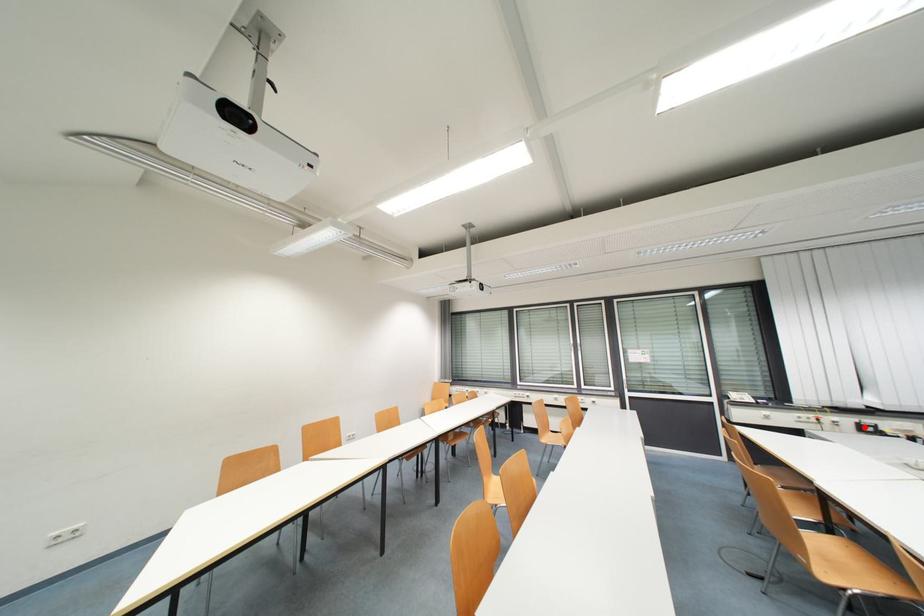
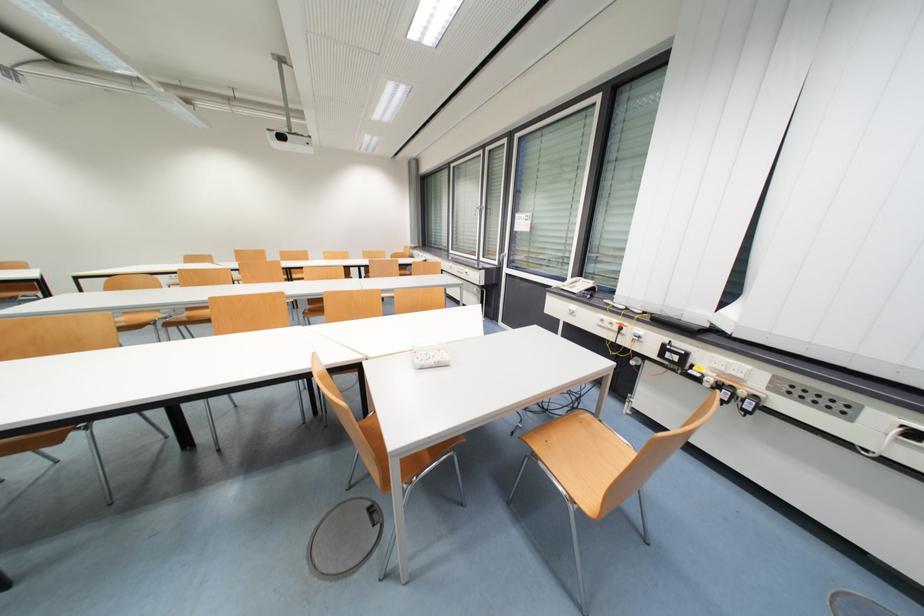
The point at the highlighted location is marked in the first image. Where is the corresponding point in the second image?

(671, 350)